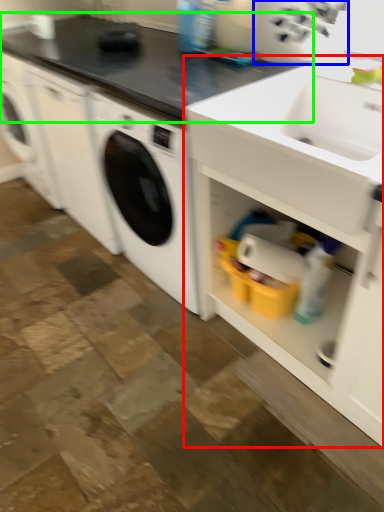
Question: Estimate the real-world distances between objects in this image. Which object is closer to cabinetry (highlighted by a red box), appliance (highlighted by a blue box) or countertop (highlighted by a green box)?

Choices:
 (A) appliance
 (B) countertop

Answer: (A)